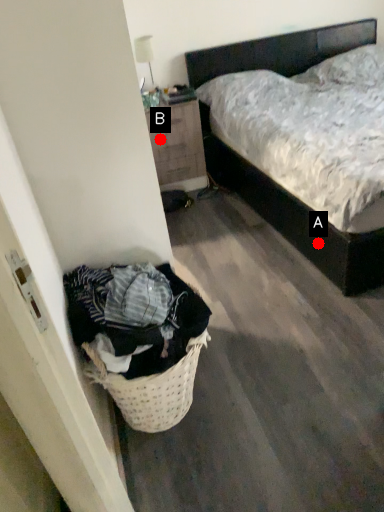
Question: Two points are circled on the image, labeled by A and B beside each circle. Which of the following is the farthest from the observer?

Choices:
 (A) A is further
 (B) B is further

Answer: (B)